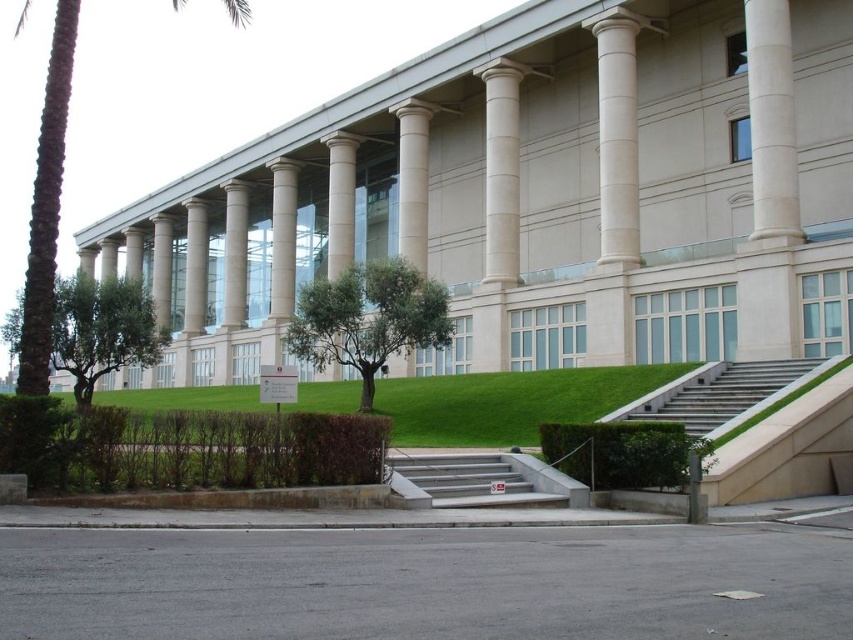
Question: Is green leafy tree at center positioned before green leafy hedge at lower center?

Choices:
 (A) no
 (B) yes

Answer: (A)

Question: Does green grass at lower center appear on the left side of smooth concrete stairs at center?

Choices:
 (A) no
 (B) yes

Answer: (B)

Question: Estimate the real-world distances between objects in this image. Which object is closer to the smooth concrete stairs at center?

Choices:
 (A) white marble pillar at center
 (B) green leafy tree at lower left
 (C) green leafy hedge at lower center
 (D) green leafy tree at center

Answer: (C)

Question: Among these points, which one is nearest to the camera?

Choices:
 (A) (651, 452)
 (B) (401, 202)
 (C) (747, 397)

Answer: (A)

Question: Which point appears closest to the camera in this image?

Choices:
 (A) (422, 209)
 (B) (618, 474)
 (C) (22, 310)

Answer: (B)

Question: Does green leafy hedge at lower center have a larger size compared to white marble pillar at center?

Choices:
 (A) no
 (B) yes

Answer: (A)